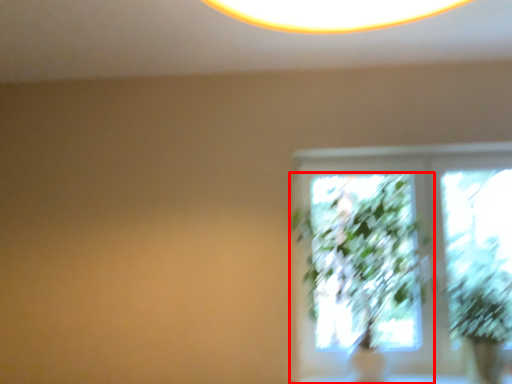
Question: From the image's perspective, considering the relative positions of houseplant (annotated by the red box) and plant in the image provided, where is houseplant (annotated by the red box) located with respect to the staircase?

Choices:
 (A) above
 (B) below

Answer: (A)